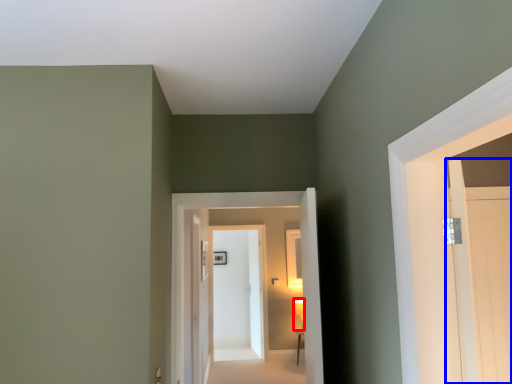
Question: Which object appears closest to the camera in this image, light fixture (highlighted by a red box) or door (highlighted by a blue box)?

Choices:
 (A) light fixture
 (B) door

Answer: (B)